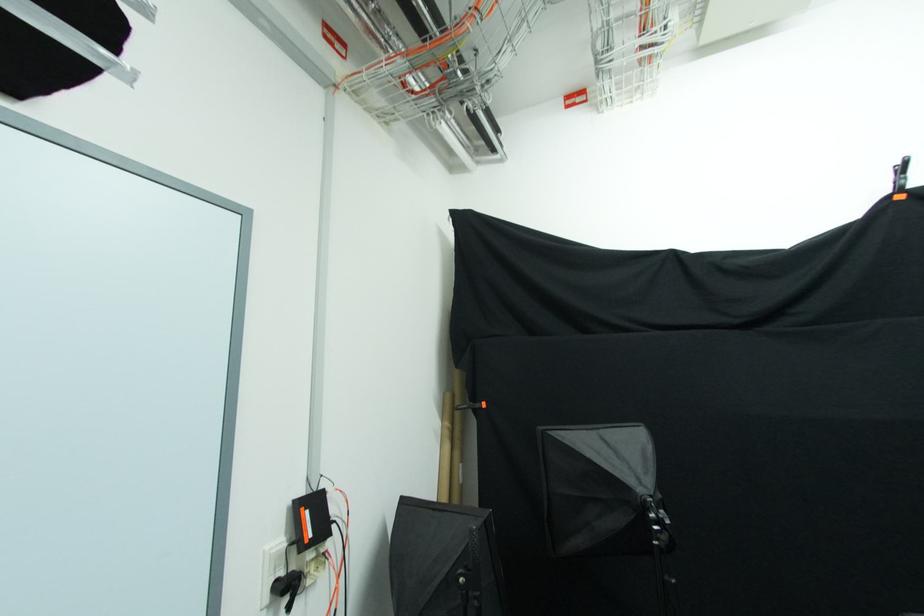
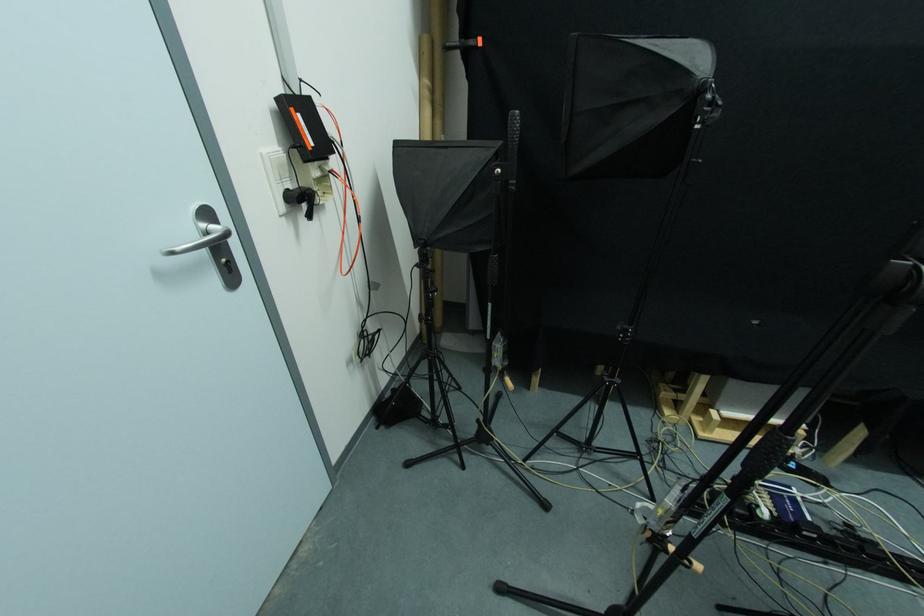
Find the pixel in the second image that matches pixel 285 577 in the first image.

(292, 188)